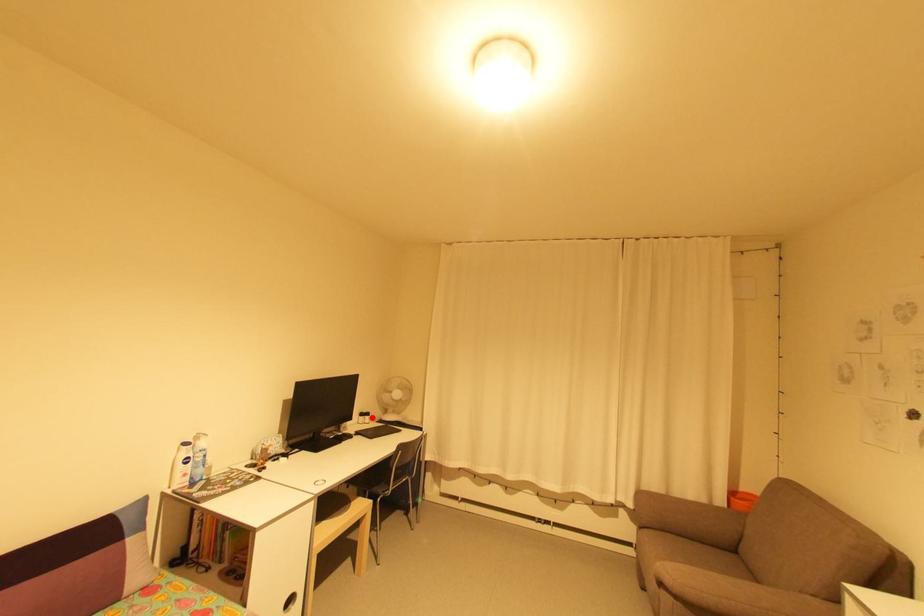
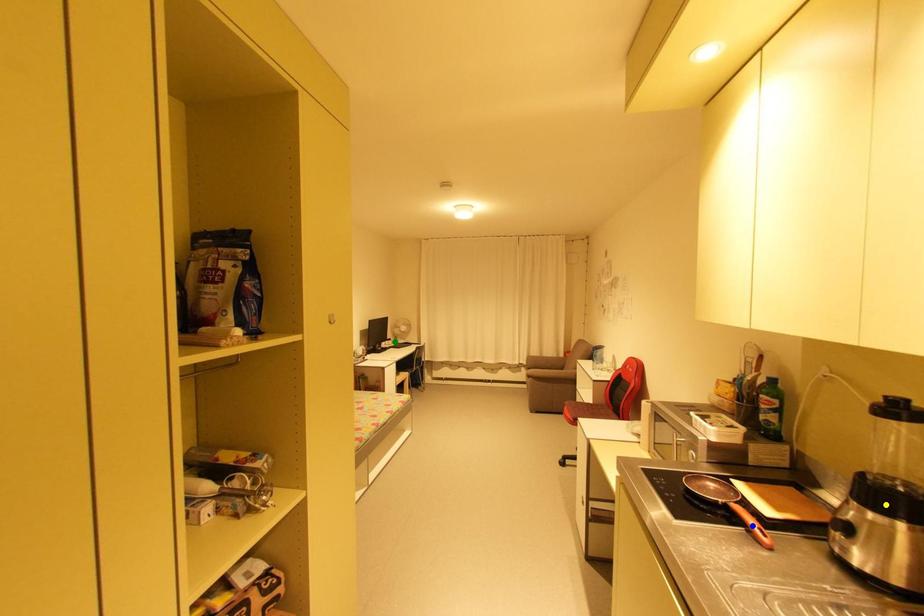
Question: I am providing you with two images of the same scene from different viewpoints. A red point is marked on the first image. You are given multiple points on the second image. Can you choose the point in image 2 that corresponds to the point in image 1?

Choices:
 (A) green point
 (B) blue point
 (C) yellow point

Answer: (A)